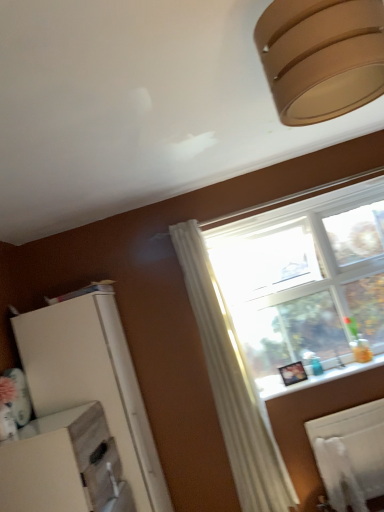
Question: Is there a large distance between matte brown lampshade at upper right and white glossy window sill at lower right?

Choices:
 (A) yes
 (B) no

Answer: (A)

Question: Is matte brown lampshade at upper right located outside white glossy window sill at lower right?

Choices:
 (A) no
 (B) yes

Answer: (B)

Question: From the image's perspective, is matte brown lampshade at upper right below white glossy window sill at lower right?

Choices:
 (A) no
 (B) yes

Answer: (A)

Question: Is matte brown lampshade at upper right directly adjacent to white glossy window sill at lower right?

Choices:
 (A) no
 (B) yes

Answer: (A)

Question: Is matte brown lampshade at upper right to the left of white glossy window sill at lower right from the viewer's perspective?

Choices:
 (A) no
 (B) yes

Answer: (B)

Question: Is white glossy window sill at lower right completely or partially inside matte brown lampshade at upper right?

Choices:
 (A) yes
 (B) no

Answer: (B)

Question: Is white matte dresser at lower left to the left of white glossy window sill at lower right from the viewer's perspective?

Choices:
 (A) no
 (B) yes

Answer: (B)

Question: Can you confirm if white matte dresser at lower left is thinner than white glossy window sill at lower right?

Choices:
 (A) yes
 (B) no

Answer: (B)

Question: Can white glossy window sill at lower right be found inside white matte dresser at lower left?

Choices:
 (A) no
 (B) yes

Answer: (A)

Question: From a real-world perspective, does white matte dresser at lower left sit lower than white glossy window sill at lower right?

Choices:
 (A) yes
 (B) no

Answer: (B)

Question: Is white matte dresser at lower left located outside white glossy window sill at lower right?

Choices:
 (A) yes
 (B) no

Answer: (A)

Question: Does white matte dresser at lower left have a greater height compared to white glossy window sill at lower right?

Choices:
 (A) no
 (B) yes

Answer: (B)

Question: Does white matte radiator at lower right come in front of matte brown lampshade at upper right?

Choices:
 (A) yes
 (B) no

Answer: (B)